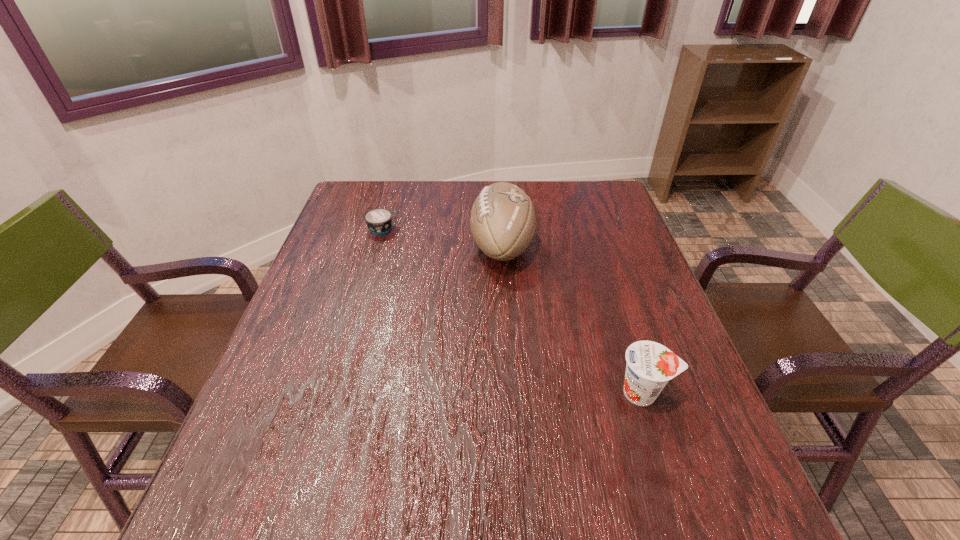
You are a GUI agent. You are given a task and a screenshot of the screen. Output one action in this format:
    pyautogui.click(x=<x>, y=<y>)
    Task: Click on the free region that satisfies the following two spatial constraints: 1. on the front side of the nearer yogurt; 2. on the left side of the farther yogurt
    
    Given the screenshot: What is the action you would take?
    pyautogui.click(x=334, y=393)